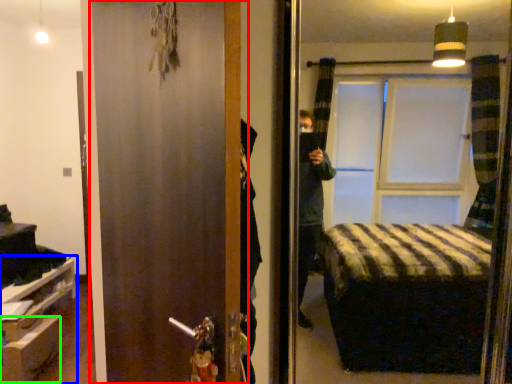
Question: Which object is positioned farthest from door (highlighted by a red box)? Select from furniture (highlighted by a blue box) and drawer (highlighted by a green box).

Choices:
 (A) furniture
 (B) drawer

Answer: (A)